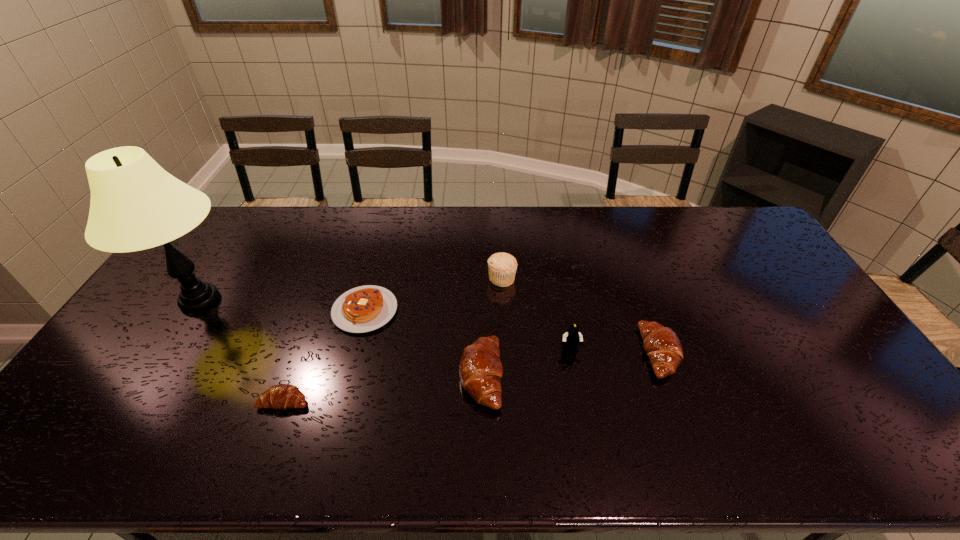
Where is `free space for a new crescent roll on the right`? The height and width of the screenshot is (540, 960). free space for a new crescent roll on the right is located at coordinates (824, 332).